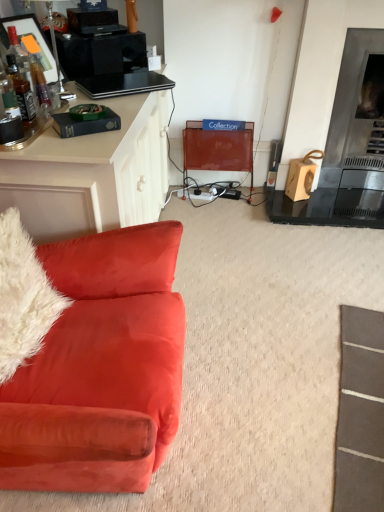
Question: Should I look upward or downward to see velvet orange couch at left?

Choices:
 (A) up
 (B) down

Answer: (B)

Question: From the image's perspective, is metallic silver fireplace at right above white fluffy pillow at left?

Choices:
 (A) yes
 (B) no

Answer: (A)

Question: Does metallic silver fireplace at right appear on the right side of white fluffy pillow at left?

Choices:
 (A) no
 (B) yes

Answer: (B)

Question: From the image's perspective, is metallic silver fireplace at right under white fluffy pillow at left?

Choices:
 (A) no
 (B) yes

Answer: (A)

Question: Could you tell me if metallic silver fireplace at right is turned towards white fluffy pillow at left?

Choices:
 (A) no
 (B) yes

Answer: (A)

Question: Can we say metallic silver fireplace at right lies outside white fluffy pillow at left?

Choices:
 (A) yes
 (B) no

Answer: (A)

Question: Is metallic silver fireplace at right thinner than white fluffy pillow at left?

Choices:
 (A) no
 (B) yes

Answer: (B)

Question: Is the position of metallic mesh swivel chair at center more distant than that of metallic silver fireplace at right?

Choices:
 (A) yes
 (B) no

Answer: (A)

Question: Does metallic mesh swivel chair at center have a greater width compared to metallic silver fireplace at right?

Choices:
 (A) no
 (B) yes

Answer: (B)

Question: Would you say metallic mesh swivel chair at center is a long distance from metallic silver fireplace at right?

Choices:
 (A) yes
 (B) no

Answer: (B)

Question: Is metallic mesh swivel chair at center oriented away from metallic silver fireplace at right?

Choices:
 (A) yes
 (B) no

Answer: (B)

Question: Can you confirm if metallic mesh swivel chair at center is thinner than metallic silver fireplace at right?

Choices:
 (A) no
 (B) yes

Answer: (A)

Question: Can you confirm if metallic mesh swivel chair at center is smaller than metallic silver fireplace at right?

Choices:
 (A) yes
 (B) no

Answer: (A)

Question: From a real-world perspective, is white fluffy pillow at left positioned over metallic mesh swivel chair at center based on gravity?

Choices:
 (A) yes
 (B) no

Answer: (A)